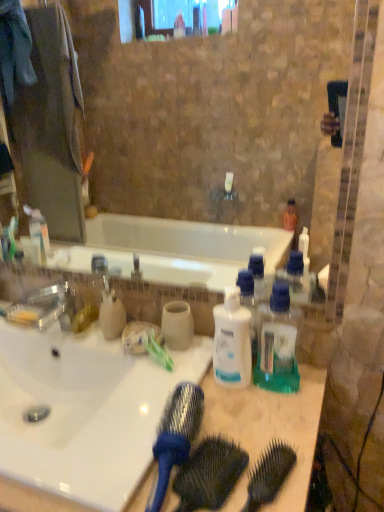
The width and height of the screenshot is (384, 512). I want to click on free location in front of translucent green plastic at center, which appears as the 2th bottle when viewed from the left, so click(x=276, y=422).